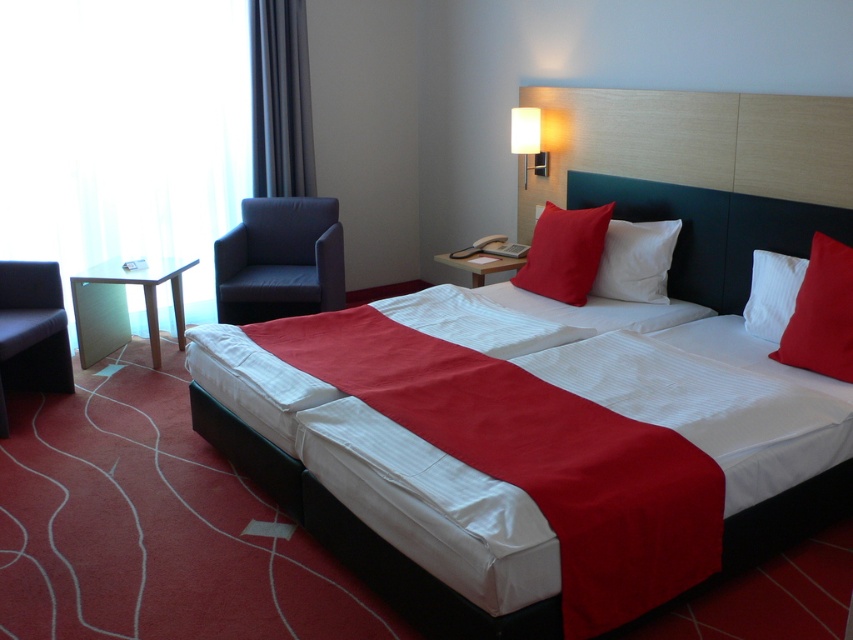
You are a guest in the hotel room and want to place a small book on the tallest red pillow. Which pillow should you choose between the matte red pillow at right and the matte red pillow at center?

The matte red pillow at center is taller than the matte red pillow at right, so you should choose the matte red pillow at center to place the small book.

You are standing in the hotel room and want to move from the bed to the armchair. There are two points marked in the room. One is at coordinates point (x=265, y=93) and the other is at point (x=786, y=262). Which point is closer to the armchair?

Point (x=265, y=93) is behind point (x=786, y=262), so the closer point to the armchair would be point (x=786, y=262).